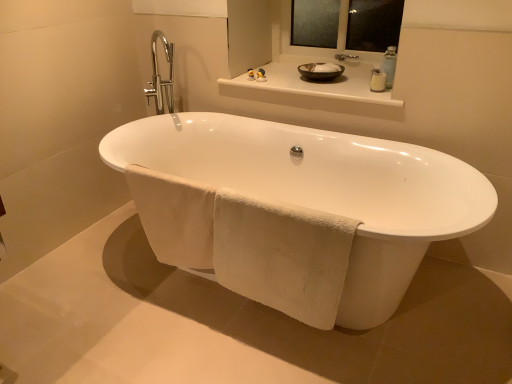
Question: Considering the relative sizes of white soft towel at lower center, which appears as the second bath towel when viewed from the right, and transparent glass mirror at upper center in the image provided, is white soft towel at lower center, which appears as the second bath towel when viewed from the right, wider than transparent glass mirror at upper center?

Choices:
 (A) no
 (B) yes

Answer: (A)

Question: Could you tell me if white soft towel at lower center, the 1th bath towel from the left, is facing transparent glass mirror at upper center?

Choices:
 (A) yes
 (B) no

Answer: (B)

Question: Does white soft towel at lower center, which appears as the second bath towel when viewed from the right, have a larger size compared to transparent glass mirror at upper center?

Choices:
 (A) no
 (B) yes

Answer: (A)

Question: Is white soft towel at lower center, which appears as the second bath towel when viewed from the right, in front of transparent glass mirror at upper center?

Choices:
 (A) yes
 (B) no

Answer: (A)

Question: Is white soft towel at lower center, the 1th bath towel from the left, thinner than transparent glass mirror at upper center?

Choices:
 (A) yes
 (B) no

Answer: (A)

Question: From a real-world perspective, is white soft towel at lower center, the 1th bath towel from the left, under transparent glass mirror at upper center?

Choices:
 (A) yes
 (B) no

Answer: (A)

Question: Is clear plastic soap dispenser at upper right behind white glossy counter top at upper center?

Choices:
 (A) no
 (B) yes

Answer: (B)

Question: From a real-world perspective, is clear plastic soap dispenser at upper right below white glossy counter top at upper center?

Choices:
 (A) no
 (B) yes

Answer: (A)

Question: From the image's perspective, is clear plastic soap dispenser at upper right located above white glossy counter top at upper center?

Choices:
 (A) yes
 (B) no

Answer: (B)

Question: Does clear plastic soap dispenser at upper right appear on the right side of white glossy counter top at upper center?

Choices:
 (A) yes
 (B) no

Answer: (A)

Question: Does clear plastic soap dispenser at upper right touch white glossy counter top at upper center?

Choices:
 (A) no
 (B) yes

Answer: (A)

Question: From the image's perspective, is clear plastic soap dispenser at upper right below white glossy counter top at upper center?

Choices:
 (A) yes
 (B) no

Answer: (A)

Question: Is white soft towel at lower center, which appears as the second bath towel when viewed from the right, closer to camera compared to white ceramic bathtub at center?

Choices:
 (A) yes
 (B) no

Answer: (B)